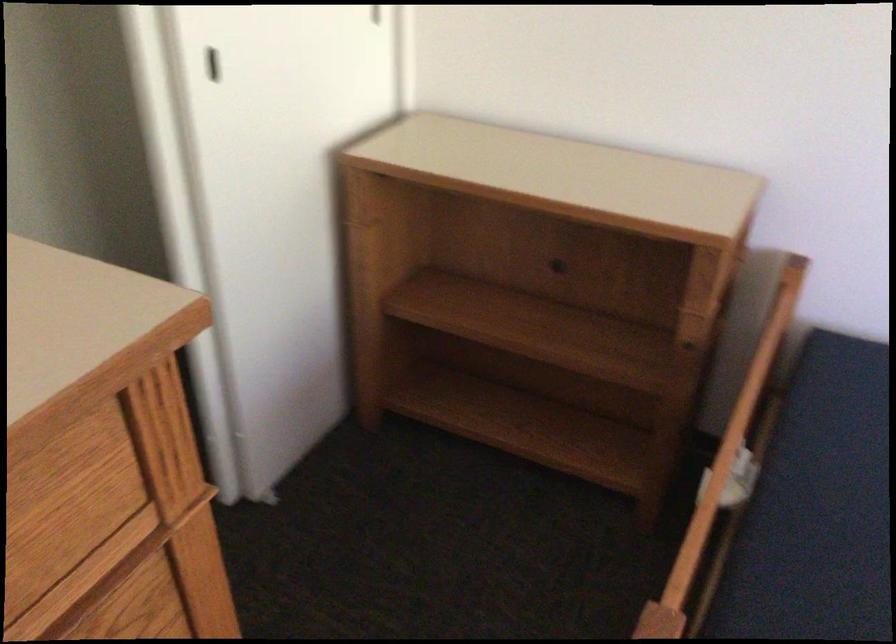
Identify the location of dark sofa sitting surface. (846, 480).